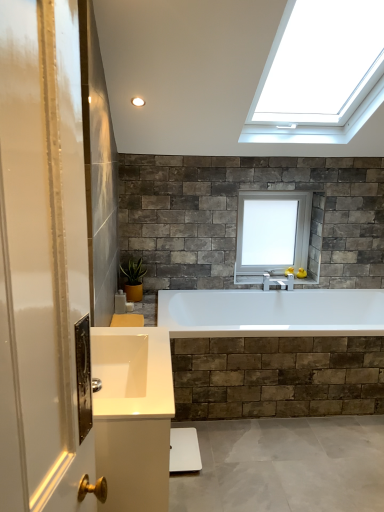
The height and width of the screenshot is (512, 384). What do you see at coordinates (272, 231) in the screenshot?
I see `white glass window at upper center` at bounding box center [272, 231].

Image resolution: width=384 pixels, height=512 pixels. In order to click on white glass window at upper center in this screenshot , I will do `click(272, 231)`.

I want to click on sink lying below the white glass window at upper center (from the image's perspective), so click(132, 372).

Which object is wider, white glossy sink at lower left or white glass window at upper center?

With larger width is white glossy sink at lower left.

Consider the image. Would you say white glossy sink at lower left is a long distance from white glass window at upper center?

white glossy sink at lower left is far away from white glass window at upper center.

Is white glass window at upper center touching green matte plant at lower left?

white glass window at upper center and green matte plant at lower left are not in contact.

From a real-world perspective, relative to green matte plant at lower left, is white glass window at upper center vertically above or below?

In terms of real-world spatial position, white glass window at upper center is above green matte plant at lower left.

Which is farther, (285, 223) or (121, 268)?

Point (285, 223)

This screenshot has height=512, width=384. I want to click on sink located below the green matte plant at lower left (from the image's perspective), so click(x=132, y=372).

From the picture: Is green matte plant at lower left inside the boundaries of white glossy sink at lower left, or outside?

green matte plant at lower left exists outside the volume of white glossy sink at lower left.

From a real-world perspective, is green matte plant at lower left physically above white glossy sink at lower left?

No, from a real-world perspective, green matte plant at lower left is not above white glossy sink at lower left.

Which object is further away from the camera, green matte plant at lower left or white glossy sink at lower left?

green matte plant at lower left is behind.

Is green matte plant at lower left further to the viewer compared to white glass window at upper center?

No, green matte plant at lower left is closer to the camera.

Measure the distance between green matte plant at lower left and white glass window at upper center.

3.52 feet.

From a real-world perspective, who is located higher, green matte plant at lower left or white glass window at upper center?

white glass window at upper center is physically above.

Is white glossy sink at lower left aimed at green matte plant at lower left?

No, white glossy sink at lower left is not aimed at green matte plant at lower left.

At what (x,y) coordinates should I click in order to perform the action: click on sink lying on the right of green matte plant at lower left. Please return your answer as a coordinate pair (x, y). The height and width of the screenshot is (512, 384). Looking at the image, I should click on (132, 372).

Considering the relative sizes of white glossy sink at lower left and green matte plant at lower left in the image provided, is white glossy sink at lower left wider than green matte plant at lower left?

Yes.

Is point (139, 379) closer or farther from the camera than point (140, 280)?

Clearly, point (139, 379) is closer to the camera than point (140, 280).

In the image, is white glass window at upper center positioned in front of or behind white glossy sink at lower left?

white glass window at upper center is positioned farther from the viewer than white glossy sink at lower left.

Is white glass window at upper center far from white glossy sink at lower left?

Yes.

Considering the points (240, 221) and (160, 346), which point is behind, point (240, 221) or point (160, 346)?

Positioned behind is point (240, 221).

Could you tell me if white glass window at upper center is turned towards white glossy sink at lower left?

No, white glass window at upper center is not facing towards white glossy sink at lower left.

You are a GUI agent. You are given a task and a screenshot of the screen. Output one action in this format:
    pyautogui.click(x=<x>, y=<y>)
    Task: Click on the window lying on the right of white glossy sink at lower left
    
    Given the screenshot: What is the action you would take?
    pyautogui.click(x=272, y=231)

Find the location of a particular element. plant beneath the white glass window at upper center (from a real-world perspective) is located at coordinates (134, 272).

Which object lies further to the anchor point white glossy sink at lower left, green matte plant at lower left or white glass window at upper center?

Based on the image, white glass window at upper center appears to be further to white glossy sink at lower left.

Estimate the real-world distances between objects in this image. Which object is closer to green matte plant at lower left, white glass window at upper center or white glossy sink at lower left?

white glass window at upper center is closer to green matte plant at lower left.

From the picture: Looking at the image, which one is located further to white glossy sink at lower left, white glass window at upper center or green matte plant at lower left?

white glass window at upper center is positioned further to the anchor white glossy sink at lower left.

Which object lies nearer to the anchor point white glass window at upper center, green matte plant at lower left or white glossy sink at lower left?

green matte plant at lower left is positioned closer to the anchor white glass window at upper center.

Looking at the image, which one is located further to green matte plant at lower left, white glossy sink at lower left or white glass window at upper center?

white glossy sink at lower left is further to green matte plant at lower left.

Based on their spatial positions, is white glossy sink at lower left or green matte plant at lower left further from white glass window at upper center?

white glossy sink at lower left.

The width and height of the screenshot is (384, 512). What are the coordinates of `plant between white glossy sink at lower left and white glass window at upper center in the front-back direction` in the screenshot? It's located at (134, 272).